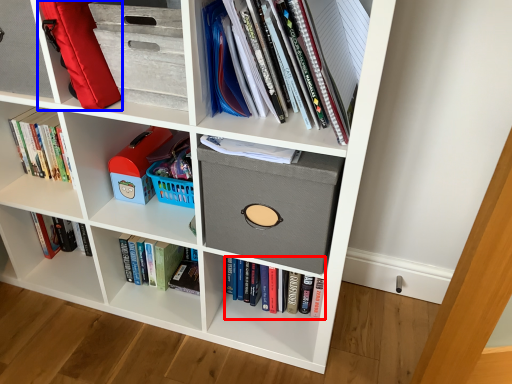
Question: Which object appears closest to the camera in this image, book (highlighted by a red box) or luggage (highlighted by a blue box)?

Choices:
 (A) book
 (B) luggage

Answer: (B)